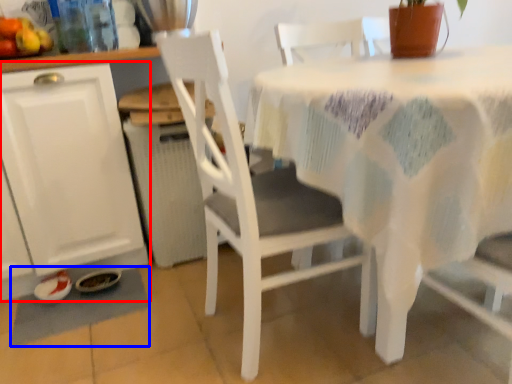
Question: Among these objects, which one is farthest to the camera, cabinetry (highlighted by a red box) or place mat (highlighted by a blue box)?

Choices:
 (A) cabinetry
 (B) place mat

Answer: (B)